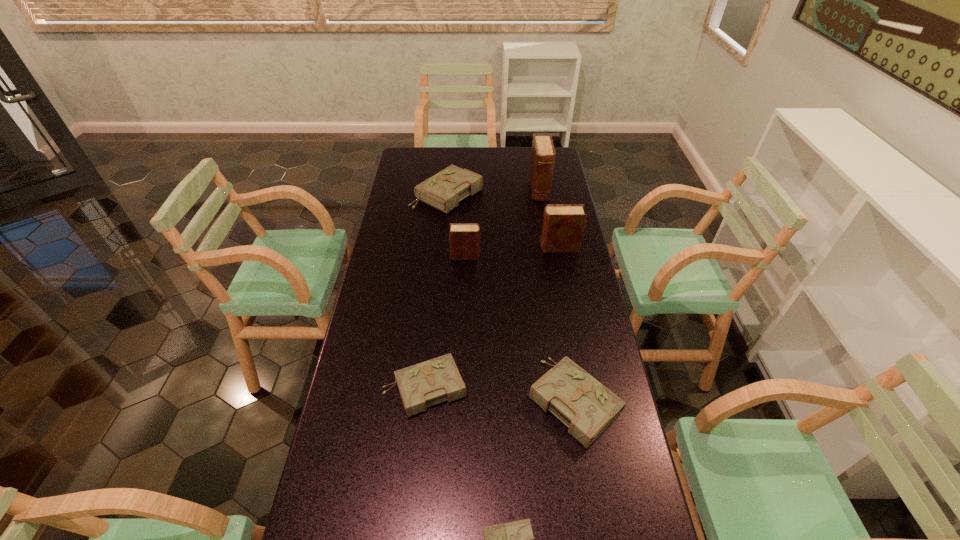
Image resolution: width=960 pixels, height=540 pixels. I want to click on the tallest object, so click(543, 154).

Locate an element on the screen. the biggest brown diary is located at coordinates (543, 154).

Where is `the second tallest object`? The image size is (960, 540). the second tallest object is located at coordinates (563, 225).

The image size is (960, 540). Identify the location of the second tallest diary. (563, 225).

Locate an element on the screen. Image resolution: width=960 pixels, height=540 pixels. the third tallest diary is located at coordinates (464, 239).

At what (x,y) coordinates should I click in order to perform the action: click on the leftmost brown diary. Please return your answer as a coordinate pair (x, y). Image resolution: width=960 pixels, height=540 pixels. Looking at the image, I should click on (464, 239).

Where is `the farthest green diary`? The image size is (960, 540). the farthest green diary is located at coordinates (443, 191).

In order to click on the third shortest diary in this screenshot , I will do `click(587, 407)`.

Find the location of a particular element. the second biggest green diary is located at coordinates (587, 407).

The image size is (960, 540). Identify the location of the second shortest object. (422, 385).